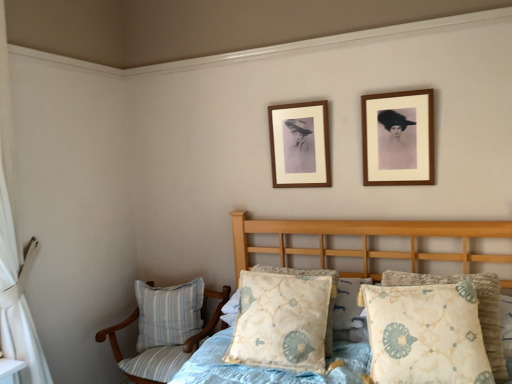
Question: In terms of width, does fluffy fabric bed at lower right look wider or thinner when compared to floral-patterned fabric pillow at center, the second pillow in the back-to-front sequence?

Choices:
 (A) wide
 (B) thin

Answer: (A)

Question: Choose the correct answer: Is fluffy fabric bed at lower right inside floral-patterned fabric pillow at center, positioned as the 2th pillow in front-to-back order, or outside it?

Choices:
 (A) inside
 (B) outside

Answer: (B)

Question: Estimate the real-world distances between objects in this image. Which object is farther from the wooden picture frame at upper right, positioned as the 1th picture frame in front-to-back order?

Choices:
 (A) floral-patterned fabric pillow at center, which appears as the first pillow when viewed from the front
 (B) matte brown picture frame at center, the 1th picture frame positioned from the back
 (C) striped fabric chair at lower left
 (D) fluffy fabric bed at lower right
 (E) blue striped pillow at lower left, the 3th pillow when ordered from front to back

Answer: (E)

Question: Which object is the farthest from the fluffy fabric bed at lower right?

Choices:
 (A) matte brown picture frame at center, the 1th picture frame positioned from the back
 (B) floral-patterned fabric pillow at center, positioned as the 2th pillow in front-to-back order
 (C) striped fabric chair at lower left
 (D) blue striped pillow at lower left, acting as the third pillow starting from the right
 (E) wooden picture frame at upper right, placed as the second picture frame when sorted from back to front

Answer: (C)